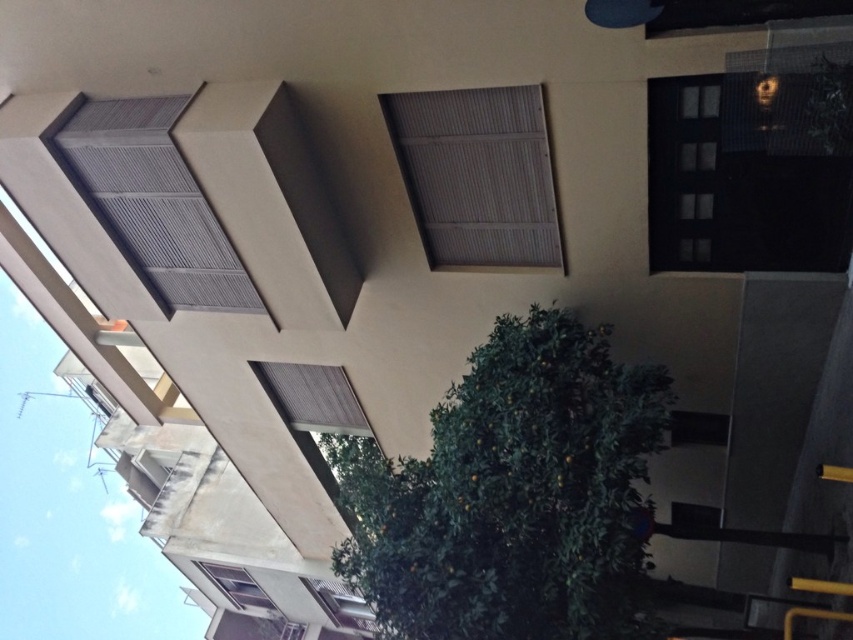
Question: Which object is closer to the camera taking this photo?

Choices:
 (A) matte gray shutters at center
 (B) matte gray window at center
 (C) gray matte window at upper left
 (D) matte gray window at lower left

Answer: (A)

Question: Estimate the real-world distances between objects in this image. Which object is closer to the matte gray shutters at center?

Choices:
 (A) gray matte window at upper left
 (B) matte gray window at center

Answer: (A)

Question: Which point is closer to the camera taking this photo?

Choices:
 (A) (252, 598)
 (B) (332, 406)
 (C) (97, 193)

Answer: (C)

Question: Is matte gray window at center behind matte gray window at lower left?

Choices:
 (A) yes
 (B) no

Answer: (B)

Question: Is matte gray window at center closer to camera compared to matte gray window at lower left?

Choices:
 (A) no
 (B) yes

Answer: (B)

Question: Is matte gray shutters at center further to camera compared to matte gray window at lower left?

Choices:
 (A) no
 (B) yes

Answer: (A)